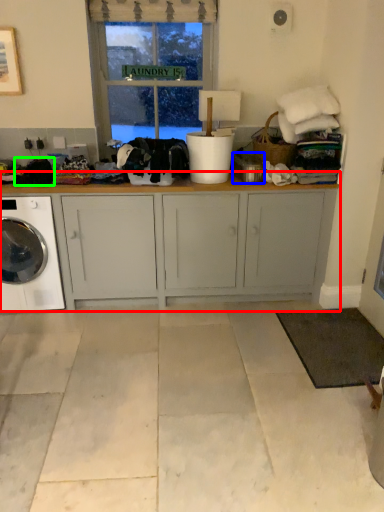
Question: Estimate the real-world distances between objects in this image. Which object is farther from cabinetry (highlighted by a red box), appliance (highlighted by a blue box) or clothing (highlighted by a green box)?

Choices:
 (A) appliance
 (B) clothing

Answer: (B)